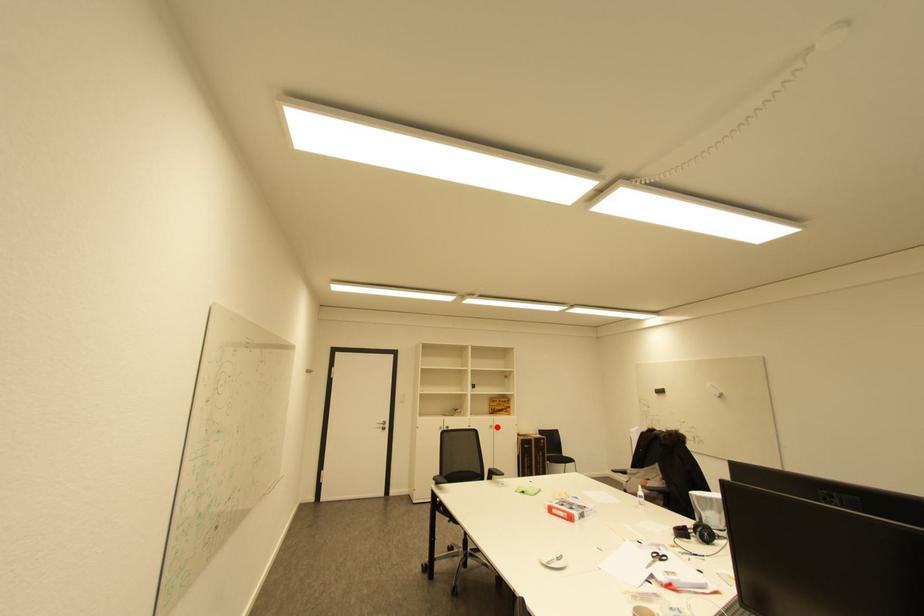
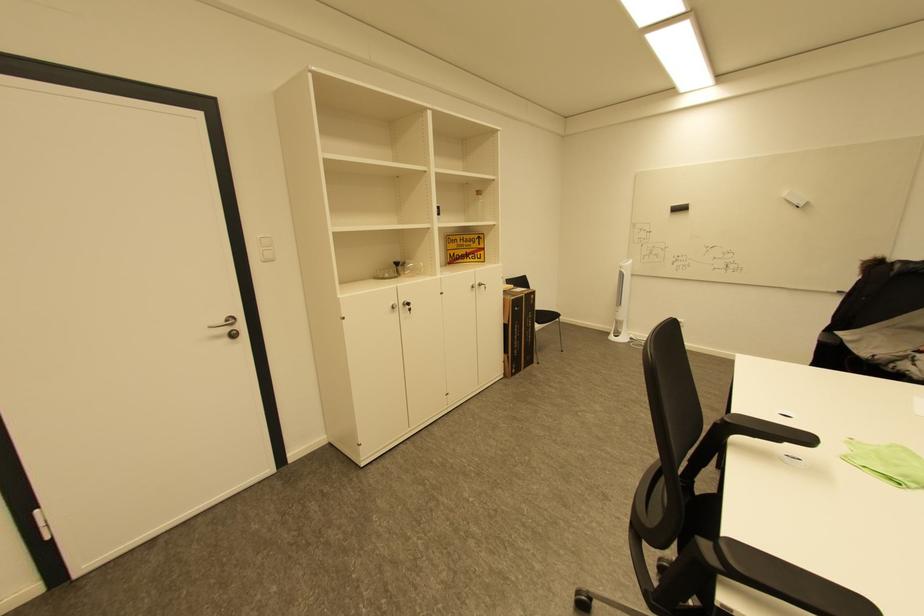
Question: A red point is marked in image1. In image2, is the corresponding 3D point closer to the camera or farther? Reply with the corresponding letter.

Choices:
 (A) The corresponding 3D point is closer.
 (B) The corresponding 3D point is farther.

Answer: (A)